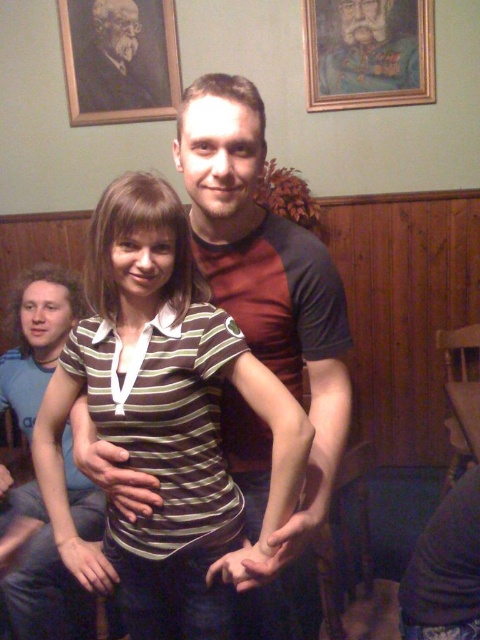
Question: Estimate the real-world distances between objects in this image. Which object is closer to the wooden picture frame at upper left?

Choices:
 (A) wooden framed portrait at upper center
 (B) striped cotton shirt at center

Answer: (A)

Question: Considering the relative positions of striped cotton shirt at center and wooden framed portrait at upper center in the image provided, where is striped cotton shirt at center located with respect to wooden framed portrait at upper center?

Choices:
 (A) right
 (B) left

Answer: (B)

Question: Which point is closer to the camera taking this photo?

Choices:
 (A) (146, 104)
 (B) (399, 24)
 (C) (142, 387)

Answer: (C)

Question: Can you confirm if striped cotton shirt at center is smaller than wooden framed portrait at upper center?

Choices:
 (A) yes
 (B) no

Answer: (B)

Question: Does striped cotton shirt at center have a lesser width compared to wooden picture frame at upper left?

Choices:
 (A) no
 (B) yes

Answer: (B)

Question: Which point is closer to the camera taking this photo?

Choices:
 (A) (159, 99)
 (B) (157, 380)
 (C) (424, 10)

Answer: (B)